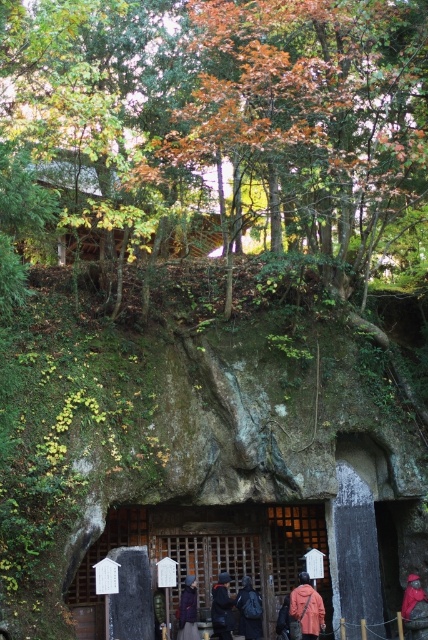
You are a hiker who wants to take a photo of the wooden cabin at upper center. You are currently standing at the entrance of the structure. Based on the coordinates provided, in which direction should you move to capture the cabin in the center of your camera frame?

The wooden cabin at upper center is located at coordinates point (38, 189). Since you are at the entrance, you should move towards the upper center direction to center the cabin in your camera frame.

You are a hiker who just arrived at the temple and placed your dark blue backpack at center and dark blue jacket at center near the entrance. You want to retrieve your jacket first. Which item should you move first to access your jacket?

The dark blue backpack at center is positioned on the right side of the dark blue jacket at center. To retrieve the jacket first, you should move the dark blue backpack at center out of the way since it is covering or blocking access to the jacket.